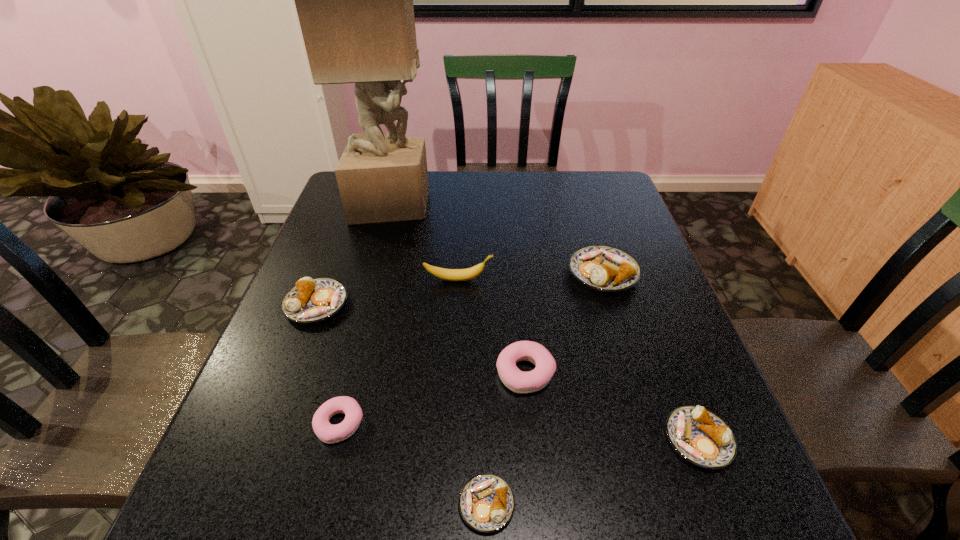
At what (x,y) coordinates should I click in order to perform the action: click on vacant space in between the fifth pastry from right to left and the fourth nearest object. Please return your answer as a coordinate pair (x, y). The image size is (960, 540). Looking at the image, I should click on (433, 398).

Identify the location of blank region between the tallest pastry and the tallest object. The image size is (960, 540). (498, 238).

Choose which object is the nearest neighbor to the third brown pastry from right to left. Please provide its 2D coordinates. Your answer should be formatted as a tuple, i.e. [(x, y)], where the tuple contains the x and y coordinates of a point satisfying the conditions above.

[(518, 381)]

Identify the location of object identified as the sixth closest to the nearest object. This screenshot has height=540, width=960. (470, 273).

Select which pastry is the fifth closest to the gray sculpture. Please provide its 2D coordinates. Your answer should be formatted as a tuple, i.e. [(x, y)], where the tuple contains the x and y coordinates of a point satisfying the conditions above.

[(486, 502)]

Where is `the third closest pastry relative to the yellow banana`? This screenshot has height=540, width=960. the third closest pastry relative to the yellow banana is located at coordinates tap(518, 381).

Choose which brown pastry is the nearest neighbor to the farther pink pastry. Please provide its 2D coordinates. Your answer should be formatted as a tuple, i.e. [(x, y)], where the tuple contains the x and y coordinates of a point satisfying the conditions above.

[(486, 502)]

Choose which brown pastry is the third nearest neighbor to the second smallest brown pastry. Please provide its 2D coordinates. Your answer should be formatted as a tuple, i.e. [(x, y)], where the tuple contains the x and y coordinates of a point satisfying the conditions above.

[(311, 300)]

Where is `vacant space that satisfies the following two spatial constraints: 1. on the front side of the leftmost brown pastry; 2. on the right side of the third farthest pastry`? vacant space that satisfies the following two spatial constraints: 1. on the front side of the leftmost brown pastry; 2. on the right side of the third farthest pastry is located at coordinates (290, 373).

Locate an element on the screen. vacant area in the image that satisfies the following two spatial constraints: 1. on the front-facing side of the tallest object; 2. on the right side of the right pink pastry is located at coordinates pyautogui.click(x=348, y=373).